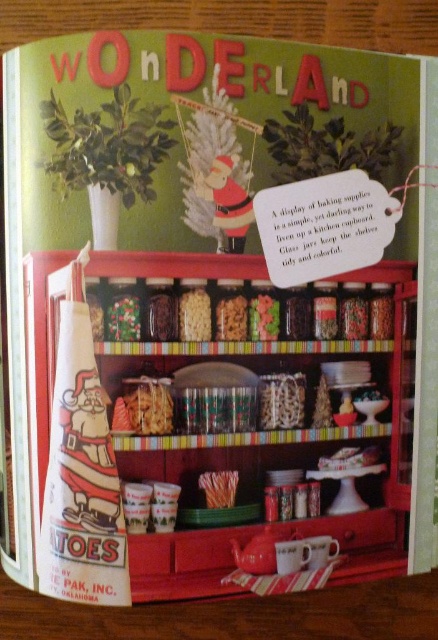
You are setting up a festive kitchen display and need to place a decorative item on the surface closest to you. Which object should you choose between the wooden table at lower center and the white matte pasta at center?

The wooden table at lower center is closer to the viewer than the white matte pasta at center, so you should place the decorative item on the wooden table at lower center.

You are a guest at a Wonderland themed party and see the wooden table at lower center and orange textured sticks at center. Which object is taller?

The wooden table at lower center is much taller than the orange textured sticks at center.